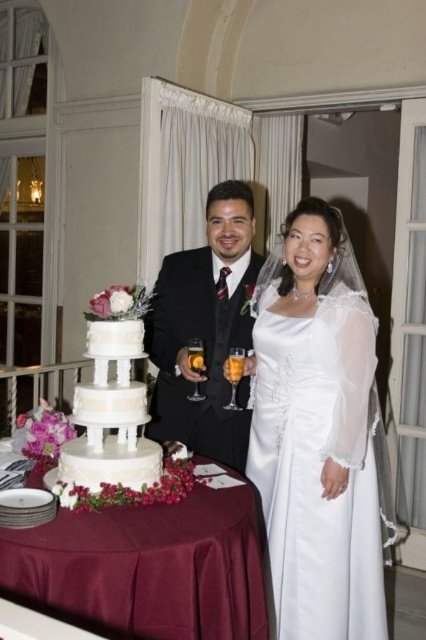
Question: Among these objects, which one is nearest to the camera?

Choices:
 (A) shiny black suit at center
 (B) white satin wedding dress at center

Answer: (B)

Question: Does white satin wedding dress at center appear on the right side of white matte wedding cake at lower left?

Choices:
 (A) yes
 (B) no

Answer: (A)

Question: Is shiny black suit at center closer to the viewer compared to white matte wedding cake at lower left?

Choices:
 (A) yes
 (B) no

Answer: (B)

Question: Is white satin wedding dress at center positioned in front of shiny black suit at center?

Choices:
 (A) yes
 (B) no

Answer: (A)

Question: Which point is closer to the camera taking this photo?

Choices:
 (A) click(x=230, y=451)
 (B) click(x=98, y=461)
 (C) click(x=23, y=600)
 (D) click(x=347, y=320)

Answer: (C)

Question: Which of the following is the closest to the observer?

Choices:
 (A) maroon satin tablecloth at center
 (B) white satin wedding dress at center
 (C) shiny black suit at center

Answer: (A)